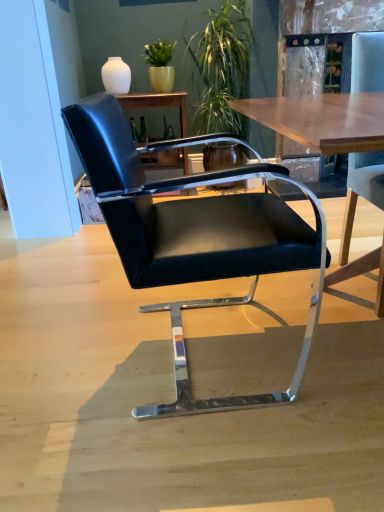
Where is `vacant space to the left of black leather chair at center, the 1th chair in the left-to-right sequence`? This screenshot has width=384, height=512. vacant space to the left of black leather chair at center, the 1th chair in the left-to-right sequence is located at coordinates (62, 373).